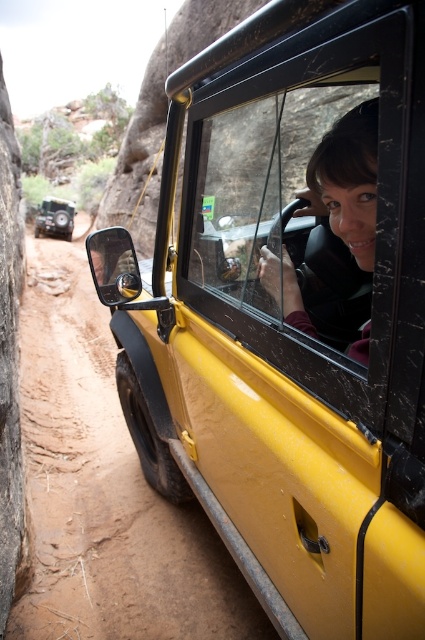
Question: Can you confirm if brown sandy dirt track at left is thinner than clear glass window at center?

Choices:
 (A) no
 (B) yes

Answer: (A)

Question: Does clear glass window at center appear on the left side of matte black jeep at left?

Choices:
 (A) no
 (B) yes

Answer: (A)

Question: Is the position of clear glass window at center less distant than that of matte black hair at center?

Choices:
 (A) no
 (B) yes

Answer: (B)

Question: Based on their relative distances, which object is farther from the brown sandy dirt track at left?

Choices:
 (A) clear glass window at center
 (B) matte black jeep at left
 (C) matte black hair at center

Answer: (B)

Question: Which object is positioned closest to the matte black jeep at left?

Choices:
 (A) brown sandy dirt track at left
 (B) clear glass window at center

Answer: (A)

Question: Which of the following is the farthest from the observer?

Choices:
 (A) (271, 289)
 (B) (91, 628)
 (C) (351, 221)

Answer: (B)